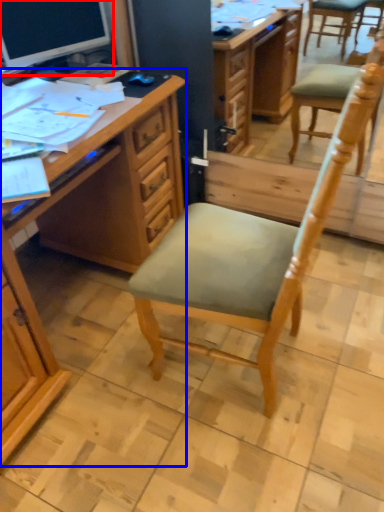
Question: Which object appears closest to the camera in this image, computer monitor (highlighted by a red box) or desk (highlighted by a blue box)?

Choices:
 (A) computer monitor
 (B) desk

Answer: (B)